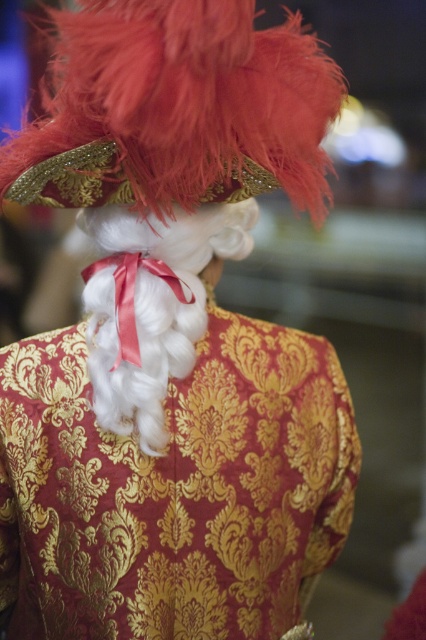
You are a costume designer trying to adjust the placement of the feathered gold hat at upper center and the white silky wig at center. Based on their sizes, which object should you consider moving first to ensure proper visibility of both elements?

The feathered gold hat at upper center is shorter than the white silky wig at center, so you should move the feathered gold hat at upper center first to ensure it doesn

You are an assistant helping to style a historical character. The feathered gold hat at upper center needs to be positioned precisely. Based on the coordinates provided, where exactly should the hat be placed relative to the person?

The feathered gold hat at upper center should be placed at coordinates point [176,109] as specified in the description.

You are an assistant helping to arrange a historical exhibition. You need to place a feathered gold hat at upper center at the exact coordinates of point (176, 109). Can you confirm if the hat is already placed correctly based on the image?

The feathered gold hat at upper center is located at point (176, 109), so yes, the hat is already placed correctly at the exact coordinates specified.